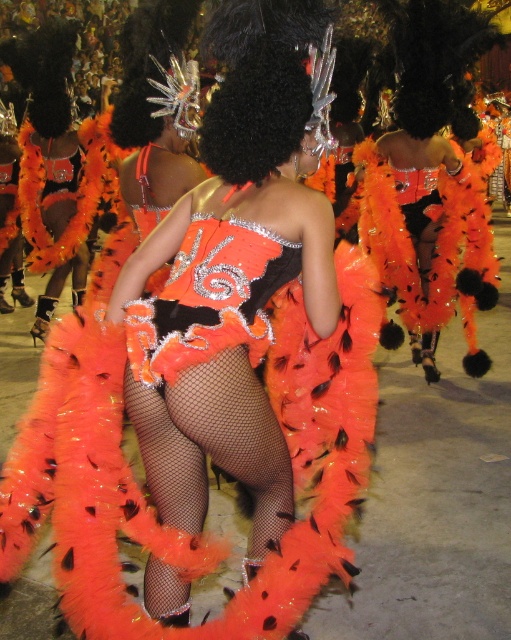
Question: Does orange feathered costume at center appear on the left side of orange feather boa at center?

Choices:
 (A) yes
 (B) no

Answer: (B)

Question: Is orange feathered costume at center above orange feather boa at center?

Choices:
 (A) no
 (B) yes

Answer: (A)

Question: Which of the following is the farthest from the observer?

Choices:
 (A) orange feathered costume at center
 (B) orange feather boa at center

Answer: (B)

Question: Can you confirm if orange feathered costume at center is positioned to the right of orange feather boa at center?

Choices:
 (A) yes
 (B) no

Answer: (A)